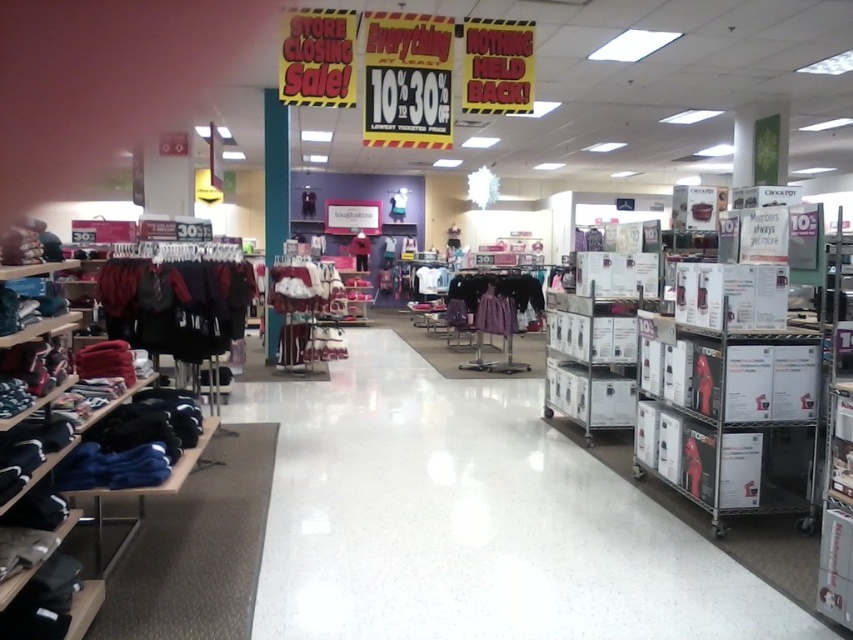
Question: Is dark red fabric shirt at left above dark blue fabric pants at left?

Choices:
 (A) no
 (B) yes

Answer: (B)

Question: Which object is farther from the camera taking this photo?

Choices:
 (A) velvet maroon dress at center
 (B) dark red fabric shirt at left

Answer: (A)

Question: Which point is farther to the camera?

Choices:
 (A) dark blue fabric pants at left
 (B) purple satin dress at center

Answer: (B)

Question: Which object is the farthest from the purple satin dress at center?

Choices:
 (A) velvet maroon dress at center
 (B) dark blue fabric pants at left
 (C) dark red fabric shirt at left

Answer: (B)

Question: Considering the relative positions of dark blue fabric pants at left and purple satin dress at center in the image provided, where is dark blue fabric pants at left located with respect to purple satin dress at center?

Choices:
 (A) below
 (B) above

Answer: (A)

Question: Is dark red fabric shirt at left closer to camera compared to dark blue fabric pants at left?

Choices:
 (A) no
 (B) yes

Answer: (A)